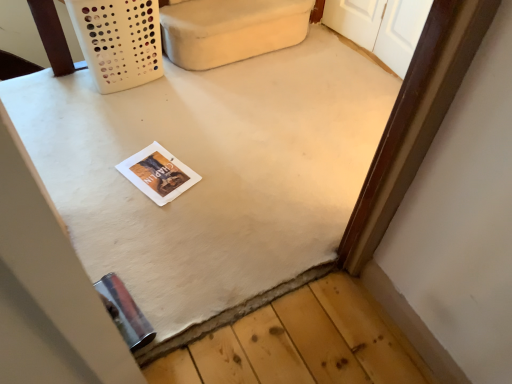
What are the coordinates of `vacant space positioned to the left of white paper magazine at center` in the screenshot? It's located at (95, 166).